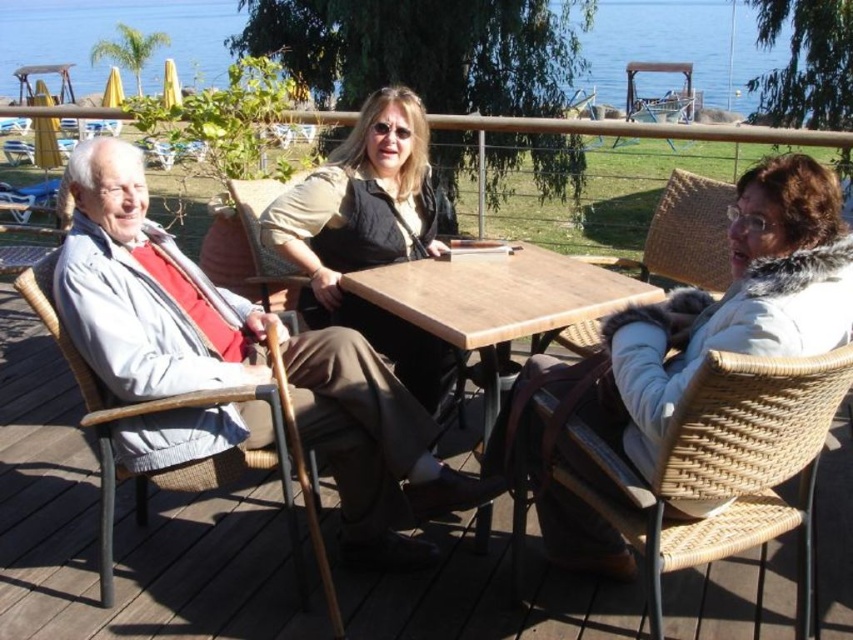
Question: Among these points, which one is nearest to the camera?

Choices:
 (A) (659, 600)
 (B) (86, 248)
 (C) (328, 182)

Answer: (A)

Question: Is matte beige vest at center to the right of wooden table at center from the viewer's perspective?

Choices:
 (A) yes
 (B) no

Answer: (B)

Question: Which point appears farthest from the camera in this image?

Choices:
 (A) (444, 292)
 (B) (660, 12)

Answer: (B)

Question: Where is wooden table at center located in relation to woven wicker chair at center in the image?

Choices:
 (A) above
 (B) below

Answer: (B)

Question: Among these objects, which one is farthest from the camera?

Choices:
 (A) woven wicker chair at center
 (B) wooden table at center
 (C) woven rattan chair at center

Answer: (C)

Question: Can you confirm if wooden table at center is wider than woven wicker chair at center?

Choices:
 (A) yes
 (B) no

Answer: (A)